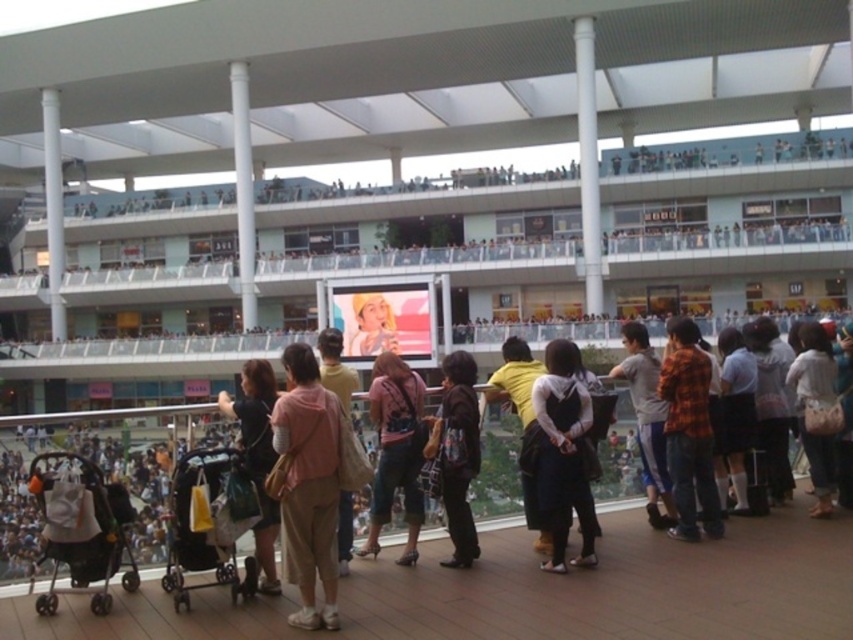
Question: Is metallic silver baby carriage at lower left above light blue denim jeans at lower right?

Choices:
 (A) yes
 (B) no

Answer: (B)

Question: Which point is closer to the camera taking this photo?

Choices:
 (A) (637, 376)
 (B) (341, 554)
 (C) (222, 401)

Answer: (B)

Question: Does metallic silver baby carriage at lower left have a smaller size compared to gray fabric pants at center?

Choices:
 (A) yes
 (B) no

Answer: (A)

Question: Does matte black backpack at center have a larger size compared to matte pink hoodie at center?

Choices:
 (A) yes
 (B) no

Answer: (B)

Question: Which object is positioned farthest from the light blue denim jeans at lower right?

Choices:
 (A) flannel shirt at center
 (B) pink fabric shirt at center
 (C) matte black backpack at center
 (D) gray fabric pants at center

Answer: (B)

Question: Which object is the closest to the gray fabric pants at center?

Choices:
 (A) black fabric baby carriage at lower left
 (B) pink fabric jacket at center
 (C) matte black backpack at center

Answer: (C)